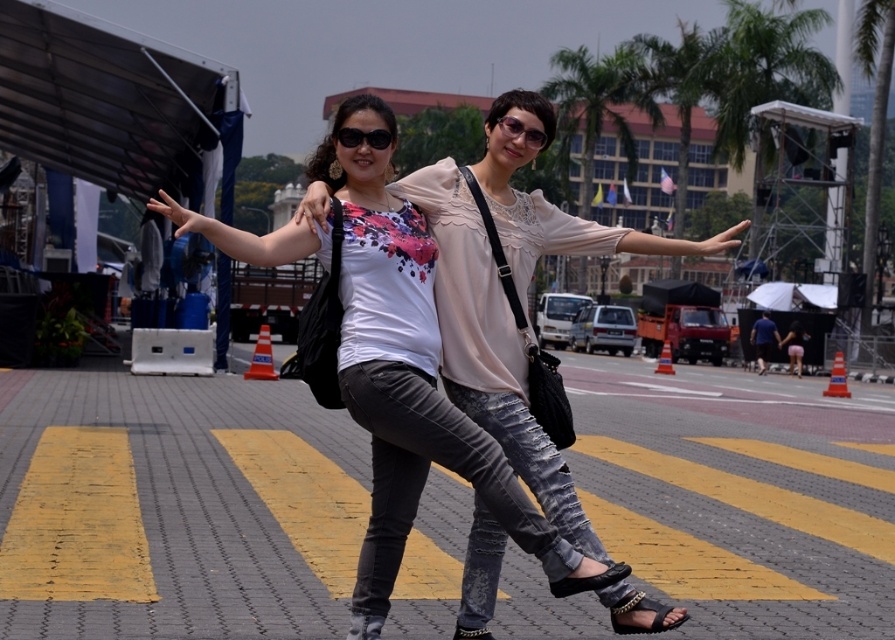
Question: Estimate the real-world distances between objects in this image. Which object is closer to the black plastic sunglasses at center?

Choices:
 (A) matte black top at center
 (B) gray brick pavement at center

Answer: (A)

Question: Does gray brick pavement at center appear on the left side of matte black top at center?

Choices:
 (A) yes
 (B) no

Answer: (B)

Question: Which of the following is the farthest from the observer?

Choices:
 (A) gray brick pavement at center
 (B) matte black top at center
 (C) black plastic sunglasses at center
 (D) matte black sunglasses at upper center

Answer: (A)

Question: Does matte black top at center have a lesser width compared to matte black sunglasses at upper center?

Choices:
 (A) yes
 (B) no

Answer: (B)

Question: Among these objects, which one is farthest from the camera?

Choices:
 (A) matte black top at center
 (B) gray brick pavement at center

Answer: (B)

Question: Observing the image, what is the correct spatial positioning of gray brick pavement at center in reference to matte black top at center?

Choices:
 (A) above
 (B) below

Answer: (B)